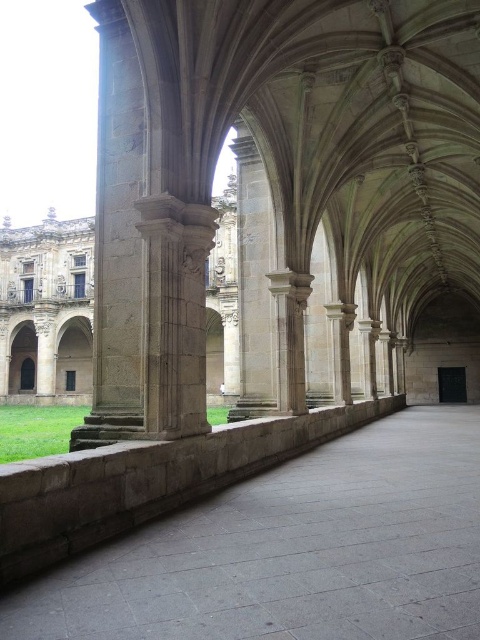
Between point (51, 556) and point (74, 403), which one is positioned behind?

The point (74, 403) is behind.

Who is positioned more to the left, brown stone ledge at lower left or brown stone column at center?

brown stone column at center is more to the left.

At what (x,y) coordinates should I click in order to perform the action: click on brown stone ledge at lower left. Please return your answer as a coordinate pair (x, y). The height and width of the screenshot is (640, 480). Looking at the image, I should click on (x=146, y=481).

Who is higher up, brown stone column at center or smooth stone pillar at center?

Positioned higher is smooth stone pillar at center.

Who is positioned more to the left, brown stone column at center or smooth stone pillar at center?

Positioned to the left is brown stone column at center.

Is point (228, 296) farther from camera compared to point (253, 209)?

Yes.

Locate an element on the screen. brown stone column at center is located at coordinates (47, 310).

Can you confirm if brown stone ledge at lower left is wider than smooth stone pillar at center?

Yes.

Does brown stone ledge at lower left appear on the left side of smooth stone pillar at center?

No, brown stone ledge at lower left is not to the left of smooth stone pillar at center.

The width and height of the screenshot is (480, 640). I want to click on brown stone ledge at lower left, so click(x=146, y=481).